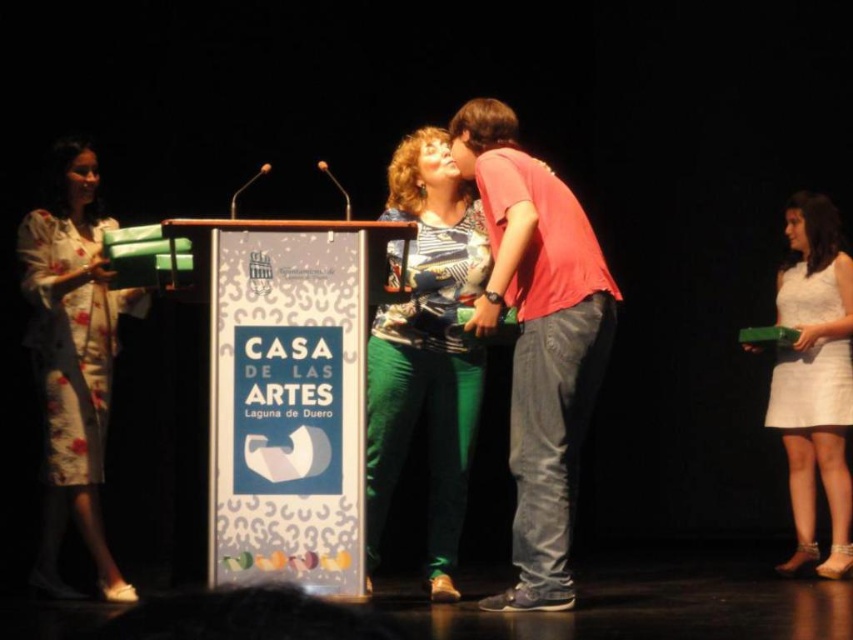
Which is more to the right, pink cotton shirt at center or floral silk dress at left?

pink cotton shirt at center

Where is `pink cotton shirt at center`? pink cotton shirt at center is located at coordinates (537, 339).

Does pink cotton shirt at center appear under white satin dress at lower right?

Incorrect, pink cotton shirt at center is not positioned below white satin dress at lower right.

Is point (532, 605) positioned behind point (846, 385)?

No.

Image resolution: width=853 pixels, height=640 pixels. What are the coordinates of `pink cotton shirt at center` in the screenshot? It's located at (537, 339).

Between printed fabric blouse at center and floral silk dress at left, which one appears on the left side from the viewer's perspective?

Positioned to the left is floral silk dress at left.

Can you confirm if printed fabric blouse at center is taller than floral silk dress at left?

Indeed, printed fabric blouse at center has a greater height compared to floral silk dress at left.

Which is in front, point (444, 321) or point (77, 512)?

Point (77, 512) is in front.

Where is `printed fabric blouse at center`? Image resolution: width=853 pixels, height=640 pixels. printed fabric blouse at center is located at coordinates (426, 352).